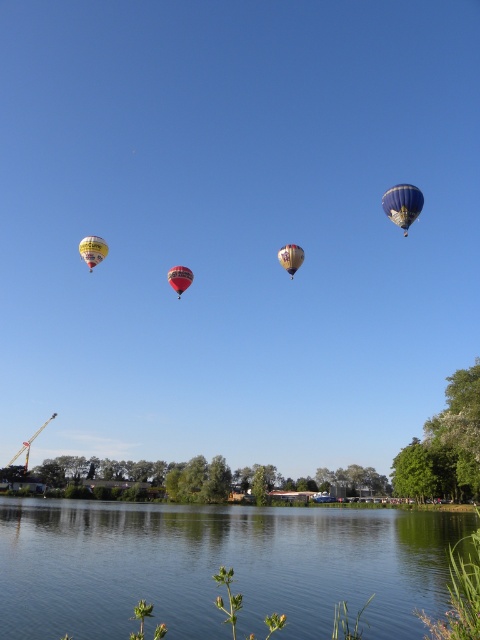
You are standing at the edge of the water and see two points in the sky. The first point is labeled as point [403,227] and the second point is labeled as point [81,259]. Which point appears closer to you?

Point [403,227] is closer to the viewer than point [81,259].